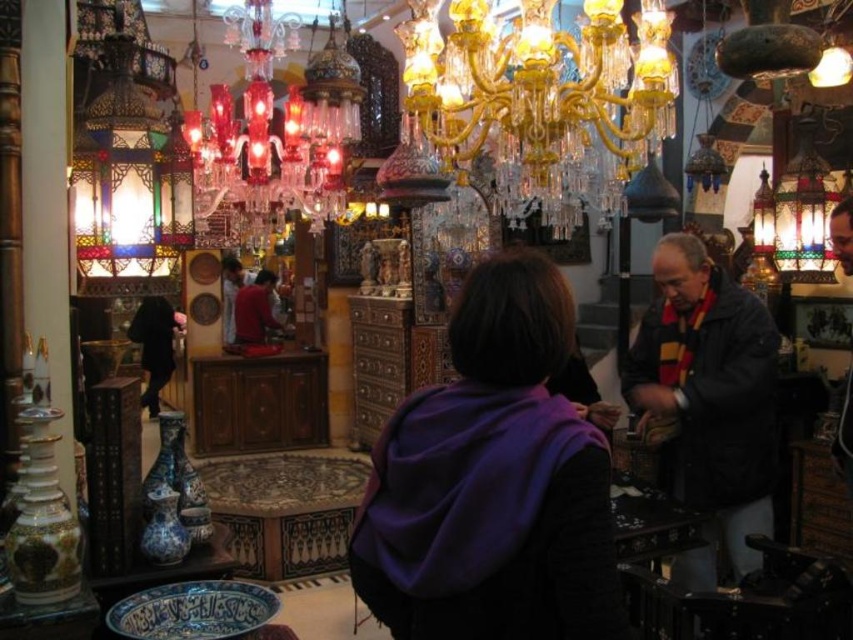
You are navigating through the market and need to reach a specific point. You see two points marked in the scene. Which point is closer to you, point (540, 410) or point (711, 547)?

Point (540, 410) is in front of point (711, 547), so it is closer to you.

You are a customer in the market and want to purchase the dark blue jacket at center. However, you notice the translucent glass chandelier at upper left hanging above it. Is there enough vertical space between the two items for you to comfortably wear the jacket while standing underneath the chandelier?

The dark blue jacket at center and the translucent glass chandelier at upper left are 8.63 feet apart. Since 8.63 feet is approximately 103.56 inches, there is ample vertical space for a person to comfortably wear the jacket while standing underneath the chandelier.

You are a customer in the market and want to pick up the dark blue jacket at center and the multicolored glass lantern at upper right. Which item should you move towards first if you are standing at the entrance on the left side of the scene?

You should move towards the dark blue jacket at center first because it is positioned on the left side of the multicolored glass lantern at upper right, making it closer to your starting position at the entrance on the left side.